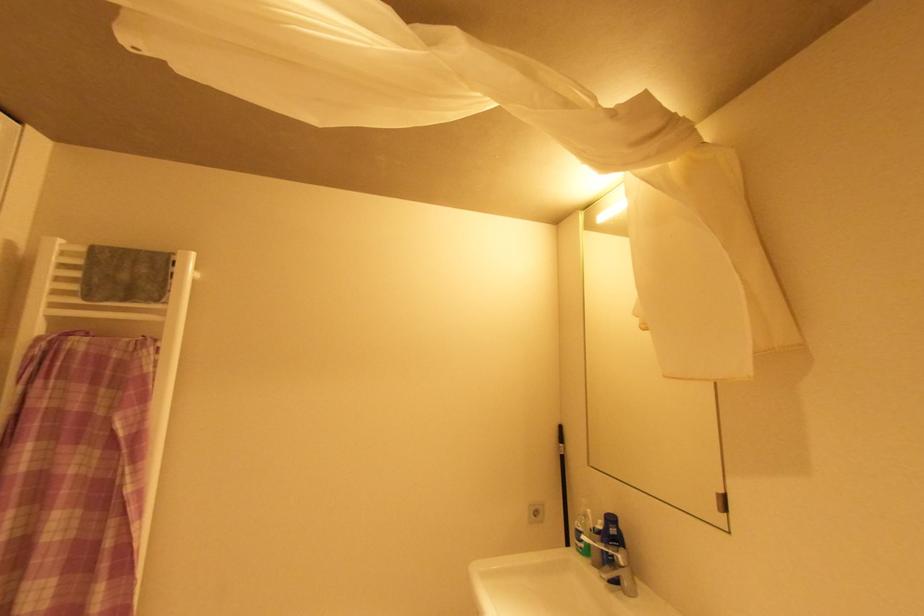
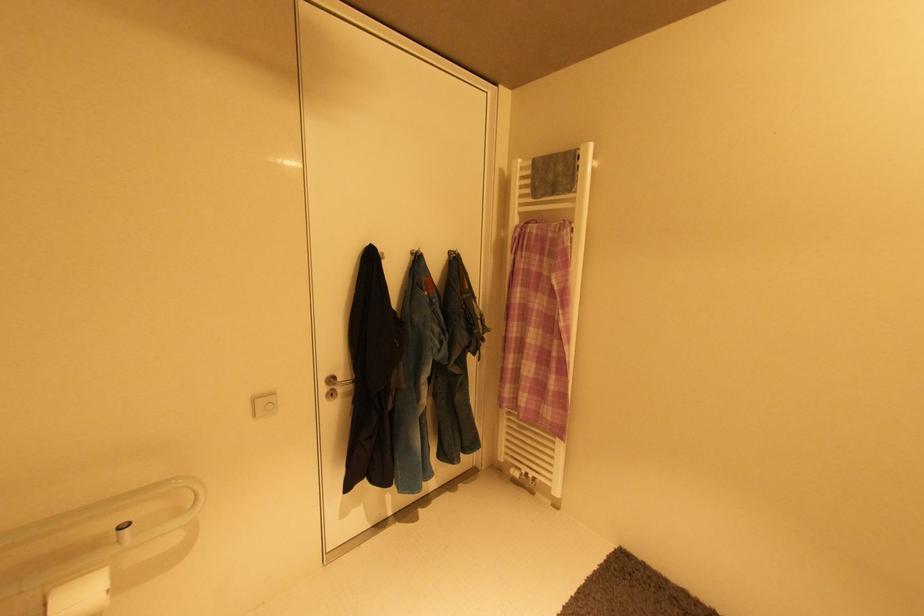
Question: The camera is either moving clockwise (left) or counter-clockwise (right) around the object. The first image is from the beginning of the video and the second image is from the end. Is the camera moving left or right when shooting the video?

Choices:
 (A) Left
 (B) Right

Answer: (B)